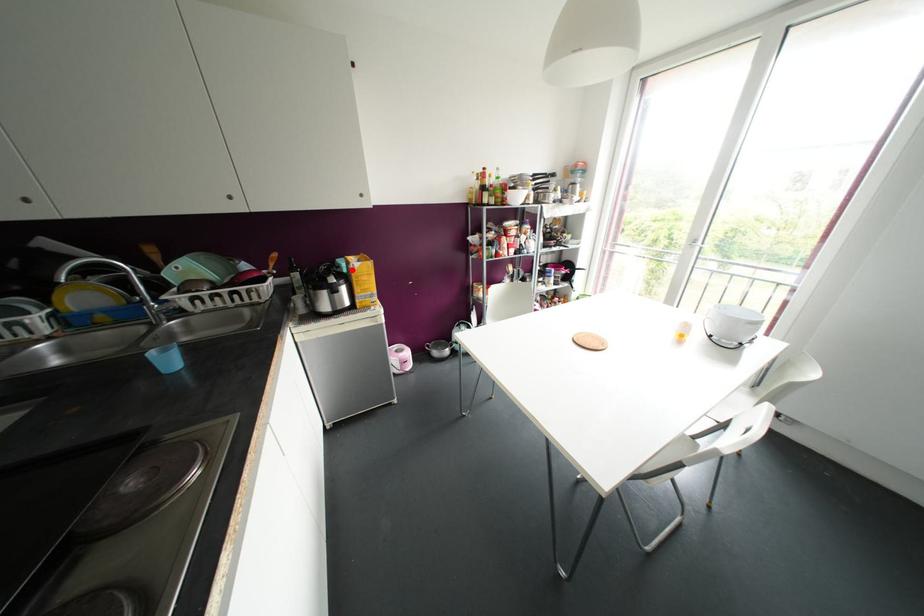
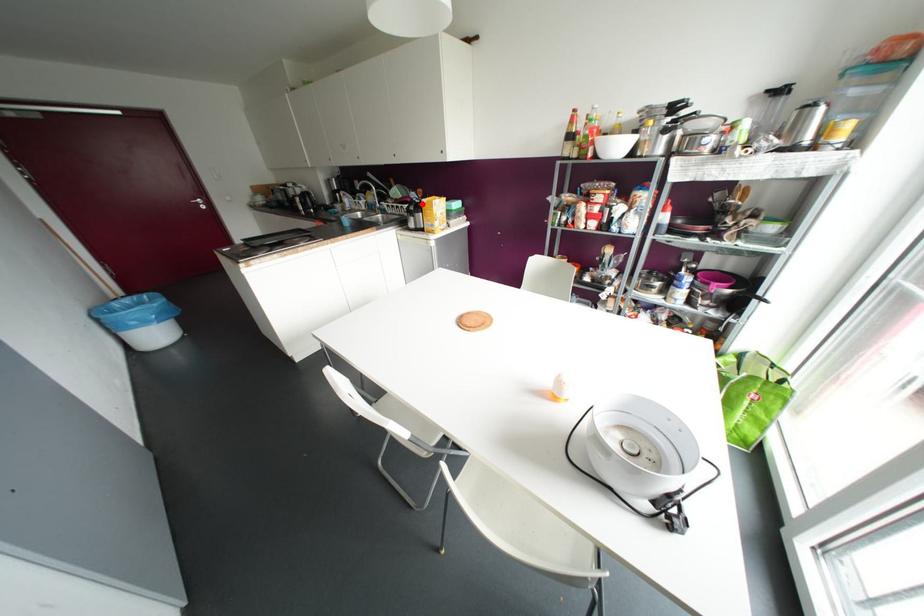
I am providing you with two images of the same scene from different viewpoints. A red point is marked on the first image and another point is marked on the second image. Is the marked point in image1 the same physical position as the marked point in image2?

Yes